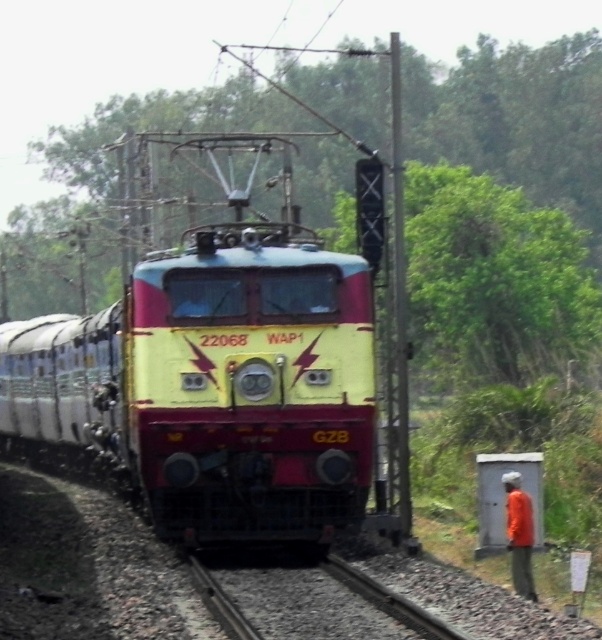
You are a photographer standing at the railway station. You want to take a photo of the yellow matte train at center and the orange fabric shirt at lower right. Which object should you focus on first if you want to capture both in the same frame without moving the camera?

The yellow matte train at center is much taller than the orange fabric shirt at lower right, so you should focus on the yellow matte train at center first to ensure its height is properly framed before adjusting for the smaller object.

You are standing on the platform waiting for the train to pass. You notice the yellow matte train at center and the orange fabric shirt at lower right. Which object is positioned higher from the ground?

The yellow matte train at center is positioned higher from the ground than the orange fabric shirt at lower right because it is above it.